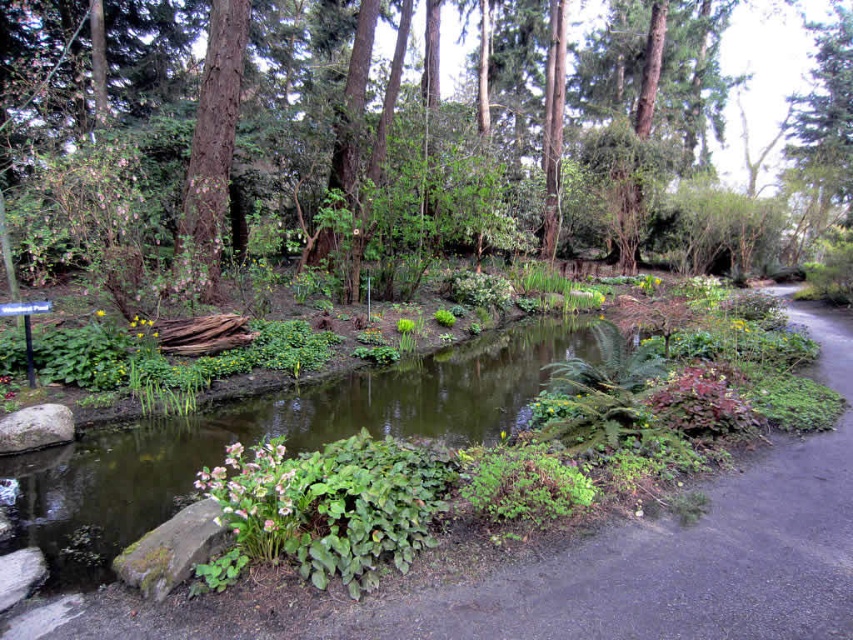
Question: Estimate the real-world distances between objects in this image. Which object is farther from the green leafy path at center?

Choices:
 (A) green rough bark tree at upper left
 (B) green leafy tree at center
 (C) green leafy stream at center
 (D) white matte flower at center

Answer: (B)

Question: Which point is closer to the camera taking this photo?

Choices:
 (A) (550, 326)
 (B) (218, 70)
 (C) (759, 49)
 (D) (595, 604)

Answer: (D)

Question: Which point is closer to the camera?

Choices:
 (A) pos(265,461)
 (B) pos(206,264)
 (C) pos(756,497)

Answer: (A)

Question: From the image, what is the correct spatial relationship of green leafy stream at center in relation to green rough bark tree at upper left?

Choices:
 (A) below
 (B) above

Answer: (A)

Question: Is white matte flower at center wider than yellow matte flower at center?

Choices:
 (A) no
 (B) yes

Answer: (B)

Question: Can you confirm if green leafy stream at center is smaller than white matte flower at center?

Choices:
 (A) no
 (B) yes

Answer: (A)